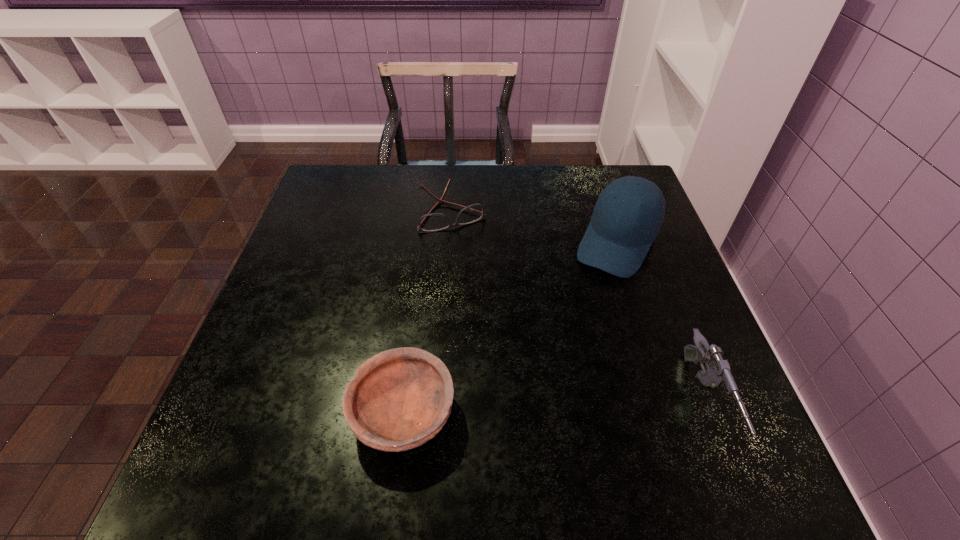
Where is `vacant region at the near edge of the desktop`? The image size is (960, 540). vacant region at the near edge of the desktop is located at coordinates (482, 426).

Locate an element on the screen. vacant space at the left edge is located at coordinates (272, 361).

You are a GUI agent. You are given a task and a screenshot of the screen. Output one action in this format:
    pyautogui.click(x=<x>, y=<y>)
    Task: Click on the free space at the right edge of the desktop
    Image resolution: width=960 pixels, height=540 pixels.
    Given the screenshot: What is the action you would take?
    pyautogui.click(x=645, y=273)

Locate an element on the screen. vacant space at the far left corner of the desktop is located at coordinates (342, 198).

Find the location of a particular element. free spot at the far right corner of the desktop is located at coordinates (600, 187).

In the image, there is a desktop. At what (x,y) coordinates should I click in order to perform the action: click on vacant space at the near right corner. Please return your answer as a coordinate pair (x, y). Looking at the image, I should click on (690, 427).

This screenshot has width=960, height=540. I want to click on free area in between the bowl and the baseball cap, so click(x=511, y=328).

At what (x,y) coordinates should I click in order to perform the action: click on vacant area between the third tallest object and the spectacles. Please return your answer as a coordinate pair (x, y). Image resolution: width=960 pixels, height=540 pixels. Looking at the image, I should click on (429, 313).

Where is `vacant area that lies between the baseball cap and the shortest object`? The image size is (960, 540). vacant area that lies between the baseball cap and the shortest object is located at coordinates (536, 227).

This screenshot has height=540, width=960. What are the coordinates of `vacant area that lies between the bowl and the spectacles` in the screenshot? It's located at (429, 313).